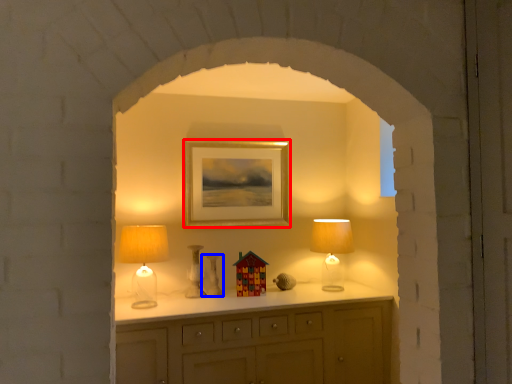
Question: Which object appears closest to the camera in this image, picture frame (highlighted by a red box) or vase (highlighted by a blue box)?

Choices:
 (A) picture frame
 (B) vase

Answer: (B)